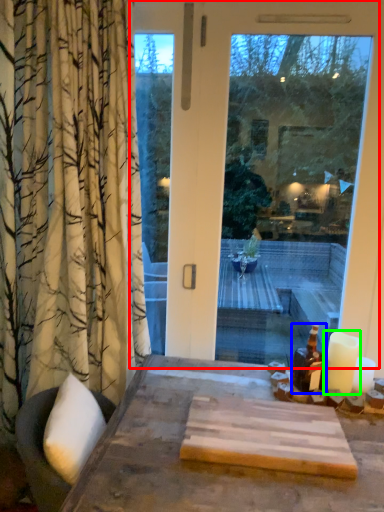
Question: Estimate the real-world distances between objects in this image. Which object is closer to window (highlighted by a red box), bottle (highlighted by a blue box) or candle (highlighted by a green box)?

Choices:
 (A) bottle
 (B) candle

Answer: (B)